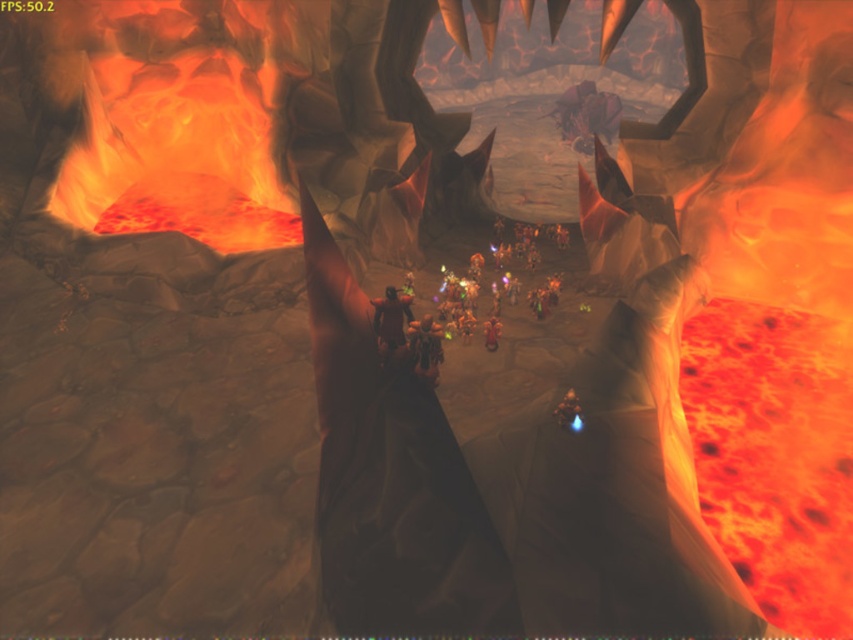
You are a character in the game and need to cross from the platform where you are standing to the other side of the cavern. There is a glowing point at coordinates point (178,140). Can you safely step on this point to cross?

The point (178,140) is on lava or molten rock fire at left, so stepping on it would be dangerous and not safe to cross.